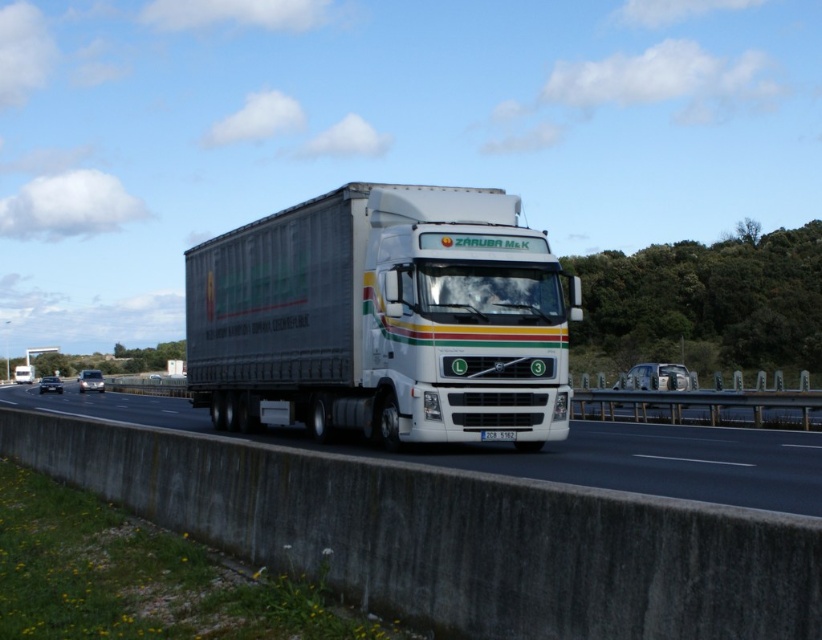
Is white matte trailer truck at center further to the viewer compared to white concrete barrier at lower center?

That is True.

Consider the image. Between white matte trailer truck at center and white concrete barrier at lower center, which one has more height?

With more height is white matte trailer truck at center.

Who is more forward, (215, 317) or (160, 410)?

Point (215, 317)

Find the location of a particular element. white matte trailer truck at center is located at coordinates (382, 320).